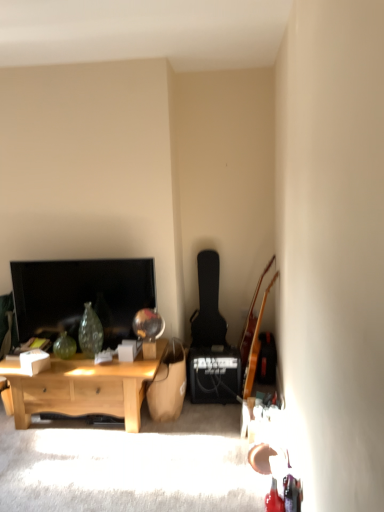
The image size is (384, 512). Find the location of `light wood desk at lower left`. light wood desk at lower left is located at coordinates (83, 388).

What do you see at coordinates (83, 388) in the screenshot?
I see `light wood desk at lower left` at bounding box center [83, 388].

Locate an element on the screen. The width and height of the screenshot is (384, 512). matte black tv at left is located at coordinates click(x=81, y=296).

In order to face wooden acoustic guitar at right, the 2th guitar from the back, should I rotate leftwards or rightwards?

To face it directly, rotate right by 9.426 degrees.

I want to click on black matte guitar at center-right, which is the second guitar from front to back, so click(208, 304).

Does black matte speaker at lower right lie behind wooden acoustic guitar at right, the 1th guitar positioned from the front?

Yes, black matte speaker at lower right is behind wooden acoustic guitar at right, the 1th guitar positioned from the front.

Considering the positions of objects black matte speaker at lower right and wooden acoustic guitar at right, the 1th guitar when ordered from right to left, in the image provided, who is more to the right, black matte speaker at lower right or wooden acoustic guitar at right, the 1th guitar when ordered from right to left,?

From the viewer's perspective, wooden acoustic guitar at right, the 1th guitar when ordered from right to left, appears more on the right side.

Is point (236, 361) positioned after point (275, 275)?

Yes, point (236, 361) is farther from viewer.

In terms of width, does black matte guitar at center-right, which is the first guitar in back-to-front order, look wider or thinner when compared to matte black tv at left?

Clearly, black matte guitar at center-right, which is the first guitar in back-to-front order, has more width compared to matte black tv at left.

Is black matte guitar at center-right, which is counted as the 1th guitar, starting from the left, to the right of matte black tv at left from the viewer's perspective?

Yes.

Consider the image. Who is smaller, black matte guitar at center-right, which is the second guitar from right to left, or matte black tv at left?

matte black tv at left is smaller.

Does matte black tv at left appear on the left side of black matte guitar at center-right, which is the second guitar from right to left?

Yes, matte black tv at left is to the left of black matte guitar at center-right, which is the second guitar from right to left.

What's the angular difference between matte black tv at left and black matte guitar at center-right, which is the first guitar in back-to-front order,'s facing directions?

3.6 degrees.

Measure the distance between matte black tv at left and black matte guitar at center-right, which is the second guitar from right to left.

34.01 inches.

Would you consider matte black tv at left to be distant from black matte guitar at center-right, which is the first guitar in back-to-front order?

They are positioned close to each other.

Does point (252, 367) come in front of point (235, 379)?

No, (252, 367) is behind (235, 379).

Is wooden acoustic guitar at right, the 1th guitar when ordered from right to left, looking in the opposite direction of black matte speaker at lower right?

No, wooden acoustic guitar at right, the 1th guitar when ordered from right to left, is not facing away from black matte speaker at lower right.

From a real-world perspective, is wooden acoustic guitar at right, the 1th guitar positioned from the front, positioned under black matte speaker at lower right based on gravity?

No, from a real-world perspective, wooden acoustic guitar at right, the 1th guitar positioned from the front, is not below black matte speaker at lower right.

Would you say wooden acoustic guitar at right, the 1th guitar when ordered from right to left, is inside or outside black matte speaker at lower right?

The correct answer is: outside.

Is matte black tv at left surrounding black matte speaker at lower right?

No, black matte speaker at lower right is not a part of matte black tv at left.

Between point (132, 332) and point (232, 360), which one is positioned in front?

The point (132, 332) is in front.

From a real-world perspective, is matte black tv at left physically located above or below black matte speaker at lower right?

matte black tv at left is above black matte speaker at lower right.

Does matte black tv at left have a smaller size compared to black matte speaker at lower right?

Incorrect, matte black tv at left is not smaller in size than black matte speaker at lower right.

Which point is more distant from viewer, (94, 267) or (163, 346)?

The point (163, 346) is farther from the camera.

What's the angular difference between matte black tv at left and light wood desk at lower left's facing directions?

The angular difference between matte black tv at left and light wood desk at lower left is 2.17 degrees.

From a real-world perspective, is matte black tv at left under light wood desk at lower left?

Actually, matte black tv at left is physically above light wood desk at lower left in the real world.

Does matte black tv at left turn towards light wood desk at lower left?

No, matte black tv at left does not turn towards light wood desk at lower left.

From a real-world perspective, is light wood desk at lower left physically below black matte guitar at center-right, which is counted as the 1th guitar, starting from the left?

Correct, in the physical world, light wood desk at lower left is lower than black matte guitar at center-right, which is counted as the 1th guitar, starting from the left.

How different are the orientations of light wood desk at lower left and black matte guitar at center-right, which is counted as the 1th guitar, starting from the left, in degrees?

There is a 1.43-degree angle between the facing directions of light wood desk at lower left and black matte guitar at center-right, which is counted as the 1th guitar, starting from the left.

Considering the sizes of objects light wood desk at lower left and black matte guitar at center-right, which is the first guitar in back-to-front order, in the image provided, who is bigger, light wood desk at lower left or black matte guitar at center-right, which is the first guitar in back-to-front order,?

light wood desk at lower left is bigger.

From the image's perspective, who appears lower, light wood desk at lower left or black matte guitar at center-right, which is the second guitar from front to back?

light wood desk at lower left is shown below in the image.

This screenshot has height=512, width=384. What are the coordinates of `speaker behind the wooden acoustic guitar at right, the 1th guitar when ordered from right to left` in the screenshot? It's located at (213, 375).

Where is `guitar that is the 1st object directly below the matte black tv at left (from a real-world perspective)`? guitar that is the 1st object directly below the matte black tv at left (from a real-world perspective) is located at coordinates (208, 304).

Based on their spatial positions, is black matte speaker at lower right or matte black tv at left closer to wooden acoustic guitar at right, the second guitar viewed from the left?

black matte speaker at lower right is closer to wooden acoustic guitar at right, the second guitar viewed from the left.

From the image, which object appears to be nearer to wooden acoustic guitar at right, the 1th guitar when ordered from right to left, black matte speaker at lower right or light wood desk at lower left?

black matte speaker at lower right lies closer to wooden acoustic guitar at right, the 1th guitar when ordered from right to left, than the other object.

Based on their spatial positions, is matte black tv at left or black matte speaker at lower right closer to black matte guitar at center-right, which is counted as the 1th guitar, starting from the left?

The object closer to black matte guitar at center-right, which is counted as the 1th guitar, starting from the left, is black matte speaker at lower right.

Based on their spatial positions, is light wood desk at lower left or black matte speaker at lower right closer to black matte guitar at center-right, which is the first guitar in back-to-front order?

Based on the image, black matte speaker at lower right appears to be nearer to black matte guitar at center-right, which is the first guitar in back-to-front order.

From the image, which object appears to be farther from black matte guitar at center-right, which is the first guitar in back-to-front order, wooden acoustic guitar at right, the 1th guitar positioned from the front, or black matte speaker at lower right?

Among the two, wooden acoustic guitar at right, the 1th guitar positioned from the front, is located further to black matte guitar at center-right, which is the first guitar in back-to-front order.

Which object lies nearer to the anchor point light wood desk at lower left, wooden acoustic guitar at right, the 1th guitar positioned from the front, or black matte guitar at center-right, which is counted as the 1th guitar, starting from the left?

black matte guitar at center-right, which is counted as the 1th guitar, starting from the left, is positioned closer to the anchor light wood desk at lower left.

Based on the photo, based on their spatial positions, is wooden acoustic guitar at right, the 2th guitar from the back, or light wood desk at lower left further from matte black tv at left?

wooden acoustic guitar at right, the 2th guitar from the back, is positioned further to the anchor matte black tv at left.

Considering their positions, is light wood desk at lower left positioned closer to wooden acoustic guitar at right, the 2th guitar from the back, than black matte speaker at lower right?

Based on the image, black matte speaker at lower right appears to be nearer to wooden acoustic guitar at right, the 2th guitar from the back.

Where is `speaker between wooden acoustic guitar at right, the 1th guitar when ordered from right to left, and black matte guitar at center-right, which is counted as the 1th guitar, starting from the left, in the front-back direction`? This screenshot has height=512, width=384. speaker between wooden acoustic guitar at right, the 1th guitar when ordered from right to left, and black matte guitar at center-right, which is counted as the 1th guitar, starting from the left, in the front-back direction is located at coordinates (213, 375).

The image size is (384, 512). Find the location of `guitar situated between light wood desk at lower left and black matte speaker at lower right from left to right`. guitar situated between light wood desk at lower left and black matte speaker at lower right from left to right is located at coordinates (208, 304).

Find the location of a particular element. This screenshot has height=512, width=384. speaker located between matte black tv at left and wooden acoustic guitar at right, the second guitar viewed from the left, in the left-right direction is located at coordinates (213, 375).

At what (x,y) coordinates should I click in order to perform the action: click on desk between matte black tv at left and wooden acoustic guitar at right, the second guitar viewed from the left, from left to right. Please return your answer as a coordinate pair (x, y). Looking at the image, I should click on (83, 388).